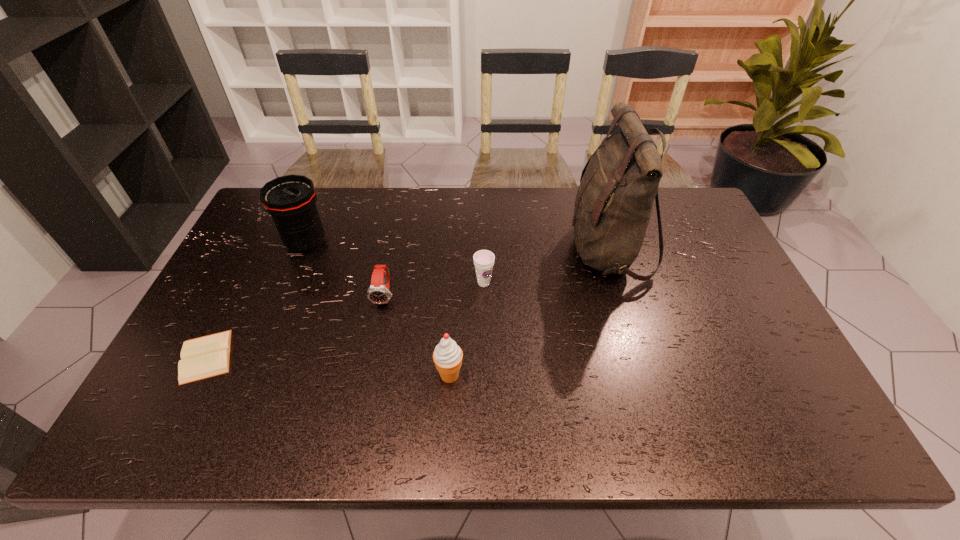
Find the location of a particular element. The height and width of the screenshot is (540, 960). vacant space located 0.350m on the open flap of the tallest object is located at coordinates (457, 250).

Find the location of a particular element. vacant space located 0.050m on the front of the telephoto lens is located at coordinates pos(295,271).

Image resolution: width=960 pixels, height=540 pixels. I want to click on vacant space positioned 0.270m on the left of the icecream, so click(324, 375).

Find the location of `vacant space located 0.180m on the back of the cup`. vacant space located 0.180m on the back of the cup is located at coordinates (484, 236).

In order to click on free space located on the face of the third object from left to right in this screenshot , I will do `click(379, 324)`.

Find the location of a particular element. This screenshot has height=540, width=960. free space located 0.210m on the right of the diary is located at coordinates pos(320,356).

Image resolution: width=960 pixels, height=540 pixels. In order to click on backpack at the far edge in this screenshot , I will do `click(614, 201)`.

The width and height of the screenshot is (960, 540). Identify the location of telephoto lens that is at the far edge. (291, 200).

This screenshot has height=540, width=960. Find the location of `telephoto lens located at the left edge`. telephoto lens located at the left edge is located at coordinates 291,200.

The height and width of the screenshot is (540, 960). I want to click on diary at the left edge, so click(208, 356).